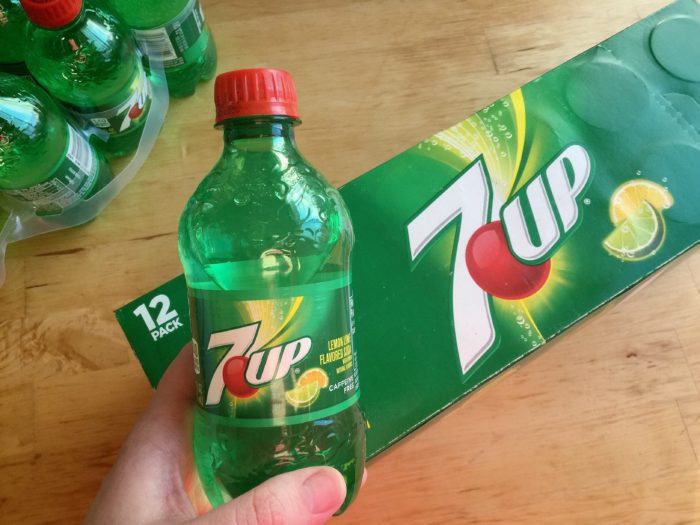
This screenshot has height=525, width=700. What are the coordinates of `table` in the screenshot? It's located at (602, 430), (393, 72), (52, 322).